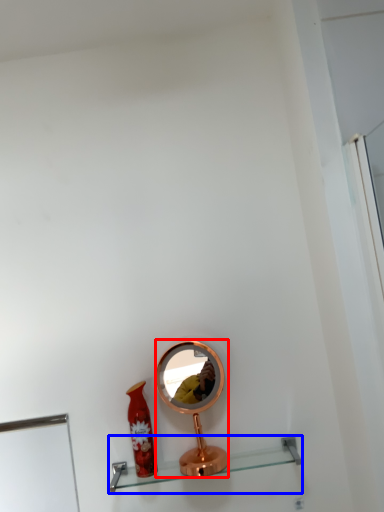
Question: Which of the following is the farthest to the observer, mirror (highlighted by a red box) or shelf (highlighted by a blue box)?

Choices:
 (A) mirror
 (B) shelf

Answer: (A)